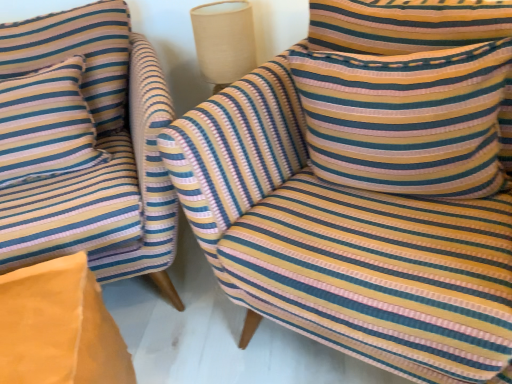
What do you see at coordinates (410, 119) in the screenshot? I see `striped fabric pillow at upper right, the second pillow in the left-to-right sequence` at bounding box center [410, 119].

This screenshot has width=512, height=384. Find the location of `striped fabric pillow at upper right, marked as the first pillow in a right-to-left arrangement`. striped fabric pillow at upper right, marked as the first pillow in a right-to-left arrangement is located at coordinates pyautogui.click(x=410, y=119).

This screenshot has width=512, height=384. Find the location of `striped fabric pillow at left, the first pillow viewed from the left`. striped fabric pillow at left, the first pillow viewed from the left is located at coordinates (46, 125).

Find the location of `striped fabric chair at left, which is the 2th chair from right to left`. striped fabric chair at left, which is the 2th chair from right to left is located at coordinates (85, 146).

Is beige fabric lampshade at upper center taller or shorter than striped fabric chair at center, which is the 1th chair from right to left?

Clearly, beige fabric lampshade at upper center is shorter compared to striped fabric chair at center, which is the 1th chair from right to left.

Does beige fabric lampshade at upper center have a smaller size compared to striped fabric chair at center, the second chair in the left-to-right sequence?

Correct, beige fabric lampshade at upper center occupies less space than striped fabric chair at center, the second chair in the left-to-right sequence.

Which of these two, beige fabric lampshade at upper center or striped fabric chair at center, the second chair in the left-to-right sequence, is thinner?

beige fabric lampshade at upper center.

Is beige fabric lampshade at upper center outside of striped fabric chair at center, the second chair in the left-to-right sequence?

Yes.

Is striped fabric pillow at left, which is counted as the 2th pillow, starting from the right, smaller than beige fabric lampshade at upper center?

Incorrect, striped fabric pillow at left, which is counted as the 2th pillow, starting from the right, is not smaller in size than beige fabric lampshade at upper center.

From a real-world perspective, between striped fabric pillow at left, the first pillow viewed from the left, and beige fabric lampshade at upper center, who is vertically lower?

In real-world perspective, striped fabric pillow at left, the first pillow viewed from the left, is lower.

Looking at their sizes, would you say striped fabric pillow at left, the first pillow viewed from the left, is wider or thinner than beige fabric lampshade at upper center?

Considering their sizes, striped fabric pillow at left, the first pillow viewed from the left, looks broader than beige fabric lampshade at upper center.

Is striped fabric pillow at left, the first pillow viewed from the left, inside the boundaries of beige fabric lampshade at upper center, or outside?

striped fabric pillow at left, the first pillow viewed from the left, is located beyond the bounds of beige fabric lampshade at upper center.

Is beige fabric lampshade at upper center not near striped fabric pillow at left, which is counted as the 2th pillow, starting from the right?

That's not correct — beige fabric lampshade at upper center is a little close to striped fabric pillow at left, which is counted as the 2th pillow, starting from the right.

Between point (194, 35) and point (83, 128), which one is positioned in front?

The point (83, 128) is in front.

Could you tell me if beige fabric lampshade at upper center is turned towards striped fabric pillow at left, the first pillow viewed from the left?

No, beige fabric lampshade at upper center is not facing towards striped fabric pillow at left, the first pillow viewed from the left.

From the image's perspective, does beige fabric lampshade at upper center appear lower than striped fabric pillow at left, which is counted as the 2th pillow, starting from the right?

No, from the image's perspective, beige fabric lampshade at upper center is not beneath striped fabric pillow at left, which is counted as the 2th pillow, starting from the right.

Is point (445, 116) less distant than point (455, 170)?

That is True.

From a real-world perspective, between striped fabric pillow at upper right, marked as the first pillow in a right-to-left arrangement, and striped fabric chair at center, the second chair in the left-to-right sequence, who is vertically higher?

In real-world perspective, striped fabric pillow at upper right, marked as the first pillow in a right-to-left arrangement, is above.

Is striped fabric pillow at upper right, the second pillow in the left-to-right sequence, smaller than striped fabric chair at center, the second chair in the left-to-right sequence?

Correct, striped fabric pillow at upper right, the second pillow in the left-to-right sequence, occupies less space than striped fabric chair at center, the second chair in the left-to-right sequence.

Is striped fabric pillow at upper right, the second pillow in the left-to-right sequence, oriented away from striped fabric chair at center, the second chair in the left-to-right sequence?

That's right, striped fabric pillow at upper right, the second pillow in the left-to-right sequence, is facing away from striped fabric chair at center, the second chair in the left-to-right sequence.

How different are the orientations of striped fabric chair at left, the first chair positioned from the left, and striped fabric chair at center, which is the 1th chair from right to left, in degrees?

striped fabric chair at left, the first chair positioned from the left, and striped fabric chair at center, which is the 1th chair from right to left, are facing 46.1 degrees away from each other.

Consider the image. From the image's perspective, is striped fabric chair at left, the first chair positioned from the left, above striped fabric chair at center, the second chair in the left-to-right sequence?

Yes, from the image's perspective, striped fabric chair at left, the first chair positioned from the left, is on top of striped fabric chair at center, the second chair in the left-to-right sequence.

Is striped fabric chair at left, which is the 2th chair from right to left, facing away from striped fabric chair at center, the second chair in the left-to-right sequence?

No, striped fabric chair at left, which is the 2th chair from right to left, is not facing the opposite direction of striped fabric chair at center, the second chair in the left-to-right sequence.

Which of these two, striped fabric chair at left, the first chair positioned from the left, or striped fabric chair at center, which is the 1th chair from right to left, is smaller?

With smaller size is striped fabric chair at center, which is the 1th chair from right to left.

Measure the distance from striped fabric pillow at upper right, marked as the first pillow in a right-to-left arrangement, to beige fabric lampshade at upper center.

striped fabric pillow at upper right, marked as the first pillow in a right-to-left arrangement, is 20.44 inches from beige fabric lampshade at upper center.

Who is smaller, striped fabric pillow at upper right, the second pillow in the left-to-right sequence, or beige fabric lampshade at upper center?

Smaller between the two is beige fabric lampshade at upper center.

Looking at this image, is striped fabric pillow at upper right, marked as the first pillow in a right-to-left arrangement, outside of beige fabric lampshade at upper center?

That's correct, striped fabric pillow at upper right, marked as the first pillow in a right-to-left arrangement, is outside of beige fabric lampshade at upper center.

Between point (293, 60) and point (233, 12), which one is positioned in front?

Positioned in front is point (293, 60).

Could you measure the distance between striped fabric pillow at upper right, marked as the first pillow in a right-to-left arrangement, and orange fabric cushion at lower left?

A distance of 28.59 inches exists between striped fabric pillow at upper right, marked as the first pillow in a right-to-left arrangement, and orange fabric cushion at lower left.

From the image's perspective, between striped fabric pillow at upper right, marked as the first pillow in a right-to-left arrangement, and orange fabric cushion at lower left, who is located below?

From the image's view, orange fabric cushion at lower left is below.

At what (x,y) coordinates should I click in order to perform the action: click on cardboard box that appears below the striped fabric pillow at upper right, marked as the first pillow in a right-to-left arrangement (from a real-world perspective). Please return your answer as a coordinate pair (x, y). Looking at the image, I should click on (59, 327).

From a real-world perspective, between striped fabric pillow at upper right, marked as the first pillow in a right-to-left arrangement, and orange fabric cushion at lower left, who is vertically higher?

striped fabric pillow at upper right, marked as the first pillow in a right-to-left arrangement.

Where is `the 2nd chair in front of the beige fabric lampshade at upper center, starting your count from the anchor`? The width and height of the screenshot is (512, 384). the 2nd chair in front of the beige fabric lampshade at upper center, starting your count from the anchor is located at coordinates (367, 185).

This screenshot has width=512, height=384. Identify the location of table lamp above the striped fabric pillow at left, the first pillow viewed from the left (from a real-world perspective). pos(224,41).

Estimate the real-world distances between objects in this image. Which object is further from orange fabric cushion at lower left, striped fabric chair at center, the second chair in the left-to-right sequence, or striped fabric pillow at left, the first pillow viewed from the left?

striped fabric chair at center, the second chair in the left-to-right sequence, is further to orange fabric cushion at lower left.

From the picture: Which object lies nearer to the anchor point beige fabric lampshade at upper center, striped fabric pillow at left, the first pillow viewed from the left, or striped fabric chair at center, the second chair in the left-to-right sequence?

Based on the image, striped fabric pillow at left, the first pillow viewed from the left, appears to be nearer to beige fabric lampshade at upper center.

Considering their positions, is striped fabric chair at left, the first chair positioned from the left, positioned closer to striped fabric chair at center, which is the 1th chair from right to left, than beige fabric lampshade at upper center?

striped fabric chair at left, the first chair positioned from the left, lies closer to striped fabric chair at center, which is the 1th chair from right to left, than the other object.

When comparing their distances from striped fabric pillow at upper right, the second pillow in the left-to-right sequence, does striped fabric chair at center, which is the 1th chair from right to left, or striped fabric pillow at left, which is counted as the 2th pillow, starting from the right, seem closer?

Result: striped fabric chair at center, which is the 1th chair from right to left, lies closer to striped fabric pillow at upper right, the second pillow in the left-to-right sequence, than the other object.

Consider the image. Estimate the real-world distances between objects in this image. Which object is further from striped fabric chair at left, the first chair positioned from the left, striped fabric pillow at upper right, marked as the first pillow in a right-to-left arrangement, or orange fabric cushion at lower left?

The object further to striped fabric chair at left, the first chair positioned from the left, is striped fabric pillow at upper right, marked as the first pillow in a right-to-left arrangement.

Estimate the real-world distances between objects in this image. Which object is further from striped fabric pillow at left, the first pillow viewed from the left, striped fabric chair at center, the second chair in the left-to-right sequence, or striped fabric chair at left, the first chair positioned from the left?

Among the two, striped fabric chair at center, the second chair in the left-to-right sequence, is located further to striped fabric pillow at left, the first pillow viewed from the left.

Looking at the image, which one is located closer to beige fabric lampshade at upper center, striped fabric pillow at upper right, marked as the first pillow in a right-to-left arrangement, or striped fabric chair at left, which is the 2th chair from right to left?

striped fabric chair at left, which is the 2th chair from right to left.

Estimate the real-world distances between objects in this image. Which object is closer to striped fabric pillow at left, which is counted as the 2th pillow, starting from the right, striped fabric chair at center, which is the 1th chair from right to left, or orange fabric cushion at lower left?

orange fabric cushion at lower left is positioned closer to the anchor striped fabric pillow at left, which is counted as the 2th pillow, starting from the right.

Identify the location of table lamp located between striped fabric pillow at left, the first pillow viewed from the left, and striped fabric chair at center, the second chair in the left-to-right sequence, in the left-right direction. (224, 41).

Identify the location of chair situated between striped fabric chair at left, the first chair positioned from the left, and striped fabric pillow at upper right, the second pillow in the left-to-right sequence, from left to right. Image resolution: width=512 pixels, height=384 pixels. [367, 185].

Find the location of a particular element. The width and height of the screenshot is (512, 384). table lamp located between striped fabric chair at left, the first chair positioned from the left, and striped fabric pillow at upper right, the second pillow in the left-to-right sequence, in the left-right direction is located at coordinates (224, 41).

Where is `cardboard box located between striped fabric pillow at left, which is counted as the 2th pillow, starting from the right, and striped fabric chair at center, which is the 1th chair from right to left, in the left-right direction`? The height and width of the screenshot is (384, 512). cardboard box located between striped fabric pillow at left, which is counted as the 2th pillow, starting from the right, and striped fabric chair at center, which is the 1th chair from right to left, in the left-right direction is located at coordinates (59, 327).